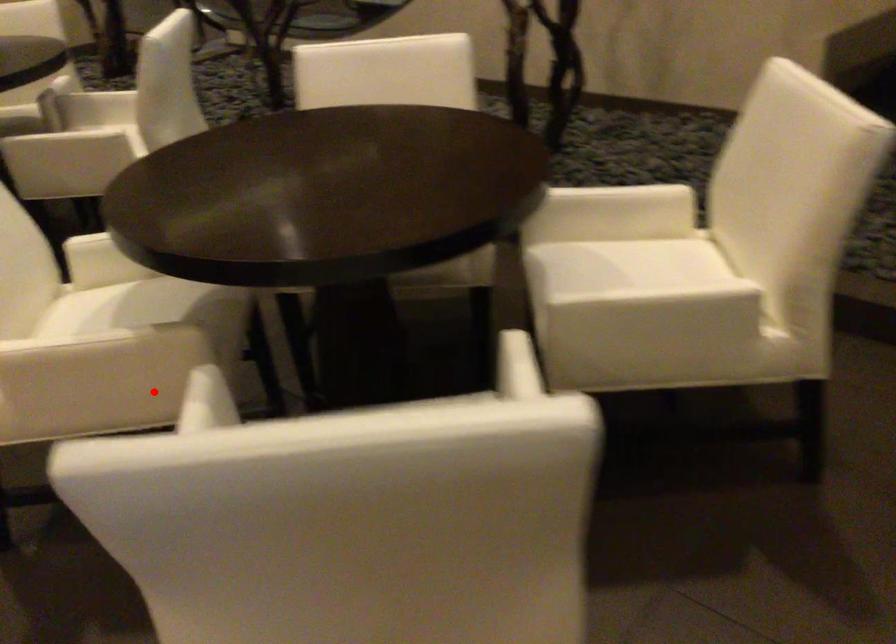
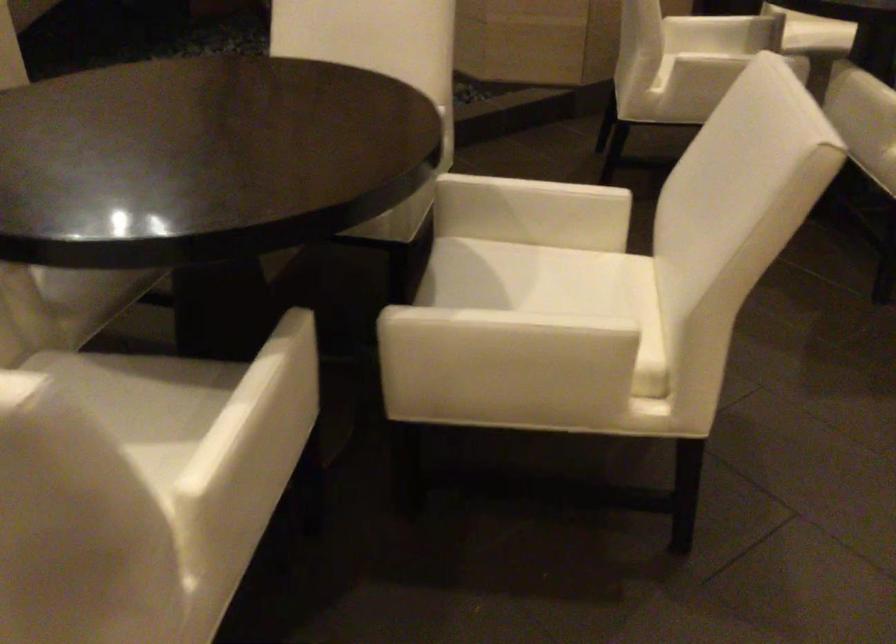
In the second image, find the point that corresponds to the highlighted location in the first image.

(299, 413)